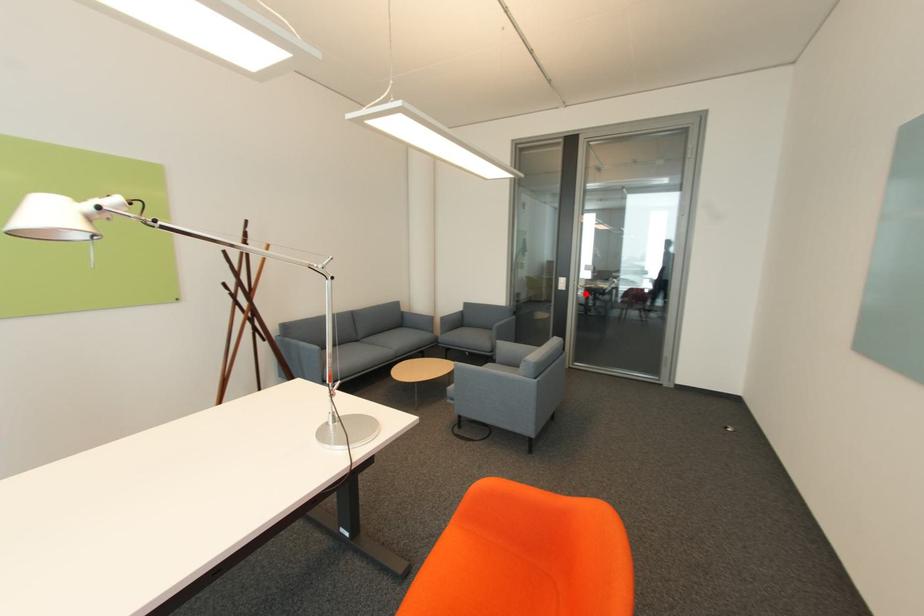
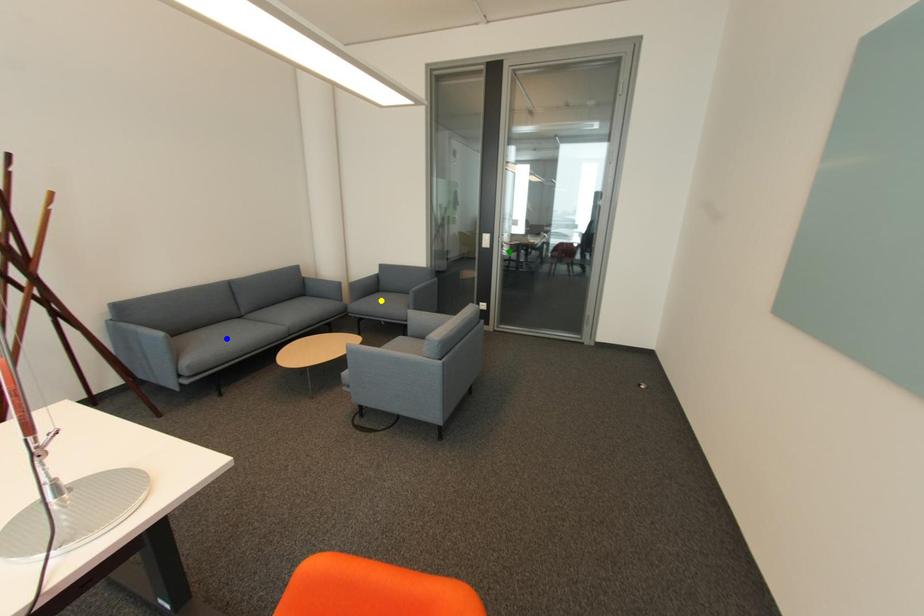
Question: I am providing you with two images of the same scene from different viewpoints. A red point is marked on the first image. You are given multiple points on the second image. In image 2, which mark is for the same physical point as the one in image 1?

Choices:
 (A) blue point
 (B) yellow point
 (C) green point

Answer: (C)